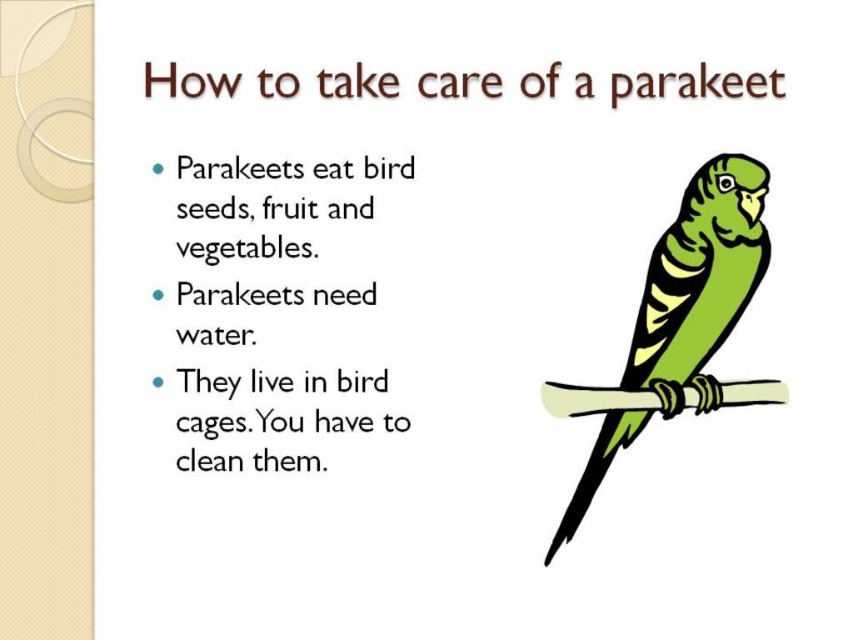
Is green matte parrot at center taller than white wood branch at center?

Correct, green matte parrot at center is much taller as white wood branch at center.

Is point (732, 298) positioned in front of point (589, 410)?

Yes, it is in front of point (589, 410).

This screenshot has height=640, width=853. What do you see at coordinates (699, 275) in the screenshot?
I see `green matte parrot at center` at bounding box center [699, 275].

Locate an element on the screen. Image resolution: width=853 pixels, height=640 pixels. green matte parrot at center is located at coordinates (699, 275).